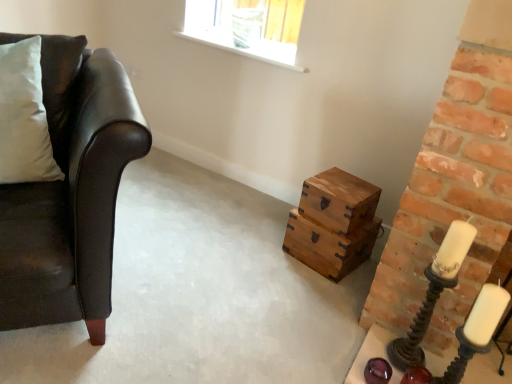
Image resolution: width=512 pixels, height=384 pixels. Find the location of `free area in between matte black leather couch at left and white wax candle at right`. free area in between matte black leather couch at left and white wax candle at right is located at coordinates pos(234,302).